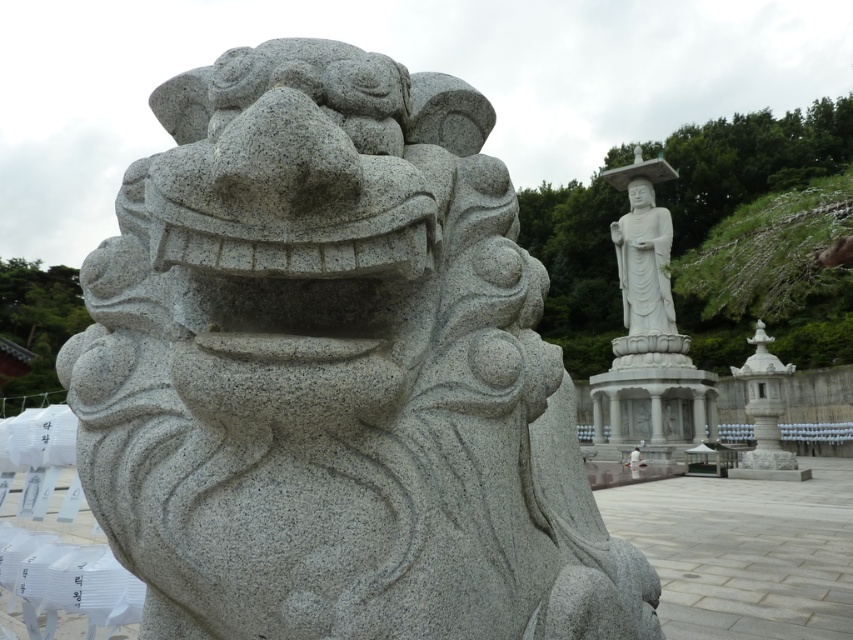
Question: Is granite statue at center below white stone statue at upper center?

Choices:
 (A) no
 (B) yes

Answer: (A)

Question: Is granite statue at center closer to camera compared to white stone statue at upper center?

Choices:
 (A) no
 (B) yes

Answer: (B)

Question: Which of the following is the closest to the observer?

Choices:
 (A) (645, 353)
 (B) (219, 280)

Answer: (B)

Question: Is granite statue at center above white stone statue at upper center?

Choices:
 (A) yes
 (B) no

Answer: (A)

Question: Which of the following is the closest to the observer?

Choices:
 (A) (480, 102)
 (B) (689, 364)

Answer: (A)